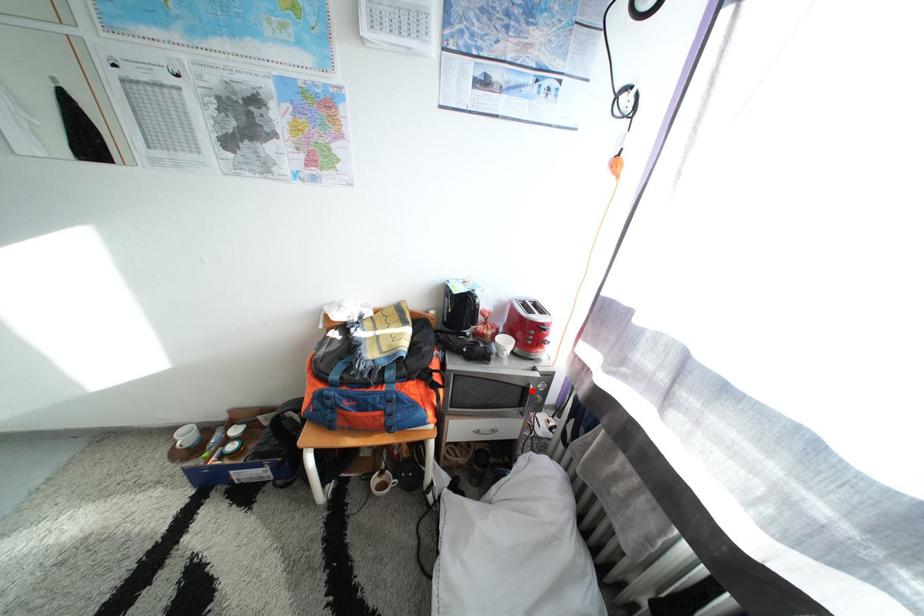
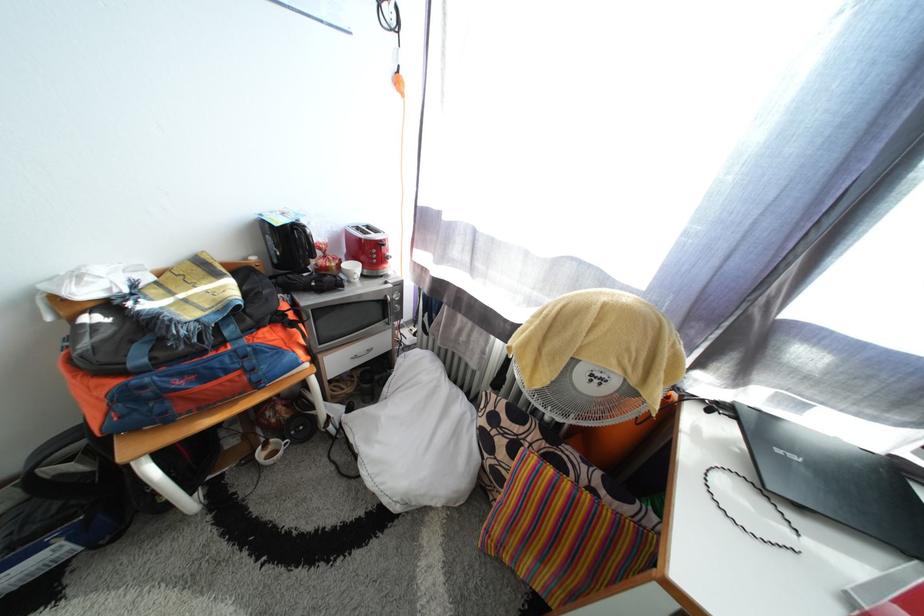
The point at the highlighted location is marked in the first image. Where is the corresponding point in the second image?

(390, 304)